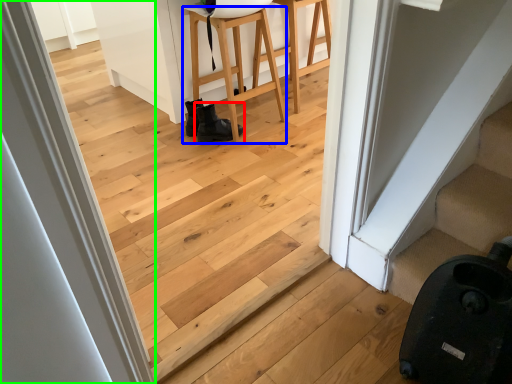
Question: Based on their relative distances, which object is nearer to footwear (highlighted by a red box)? Choose from furniture (highlighted by a blue box) and door (highlighted by a green box).

Choices:
 (A) furniture
 (B) door

Answer: (A)